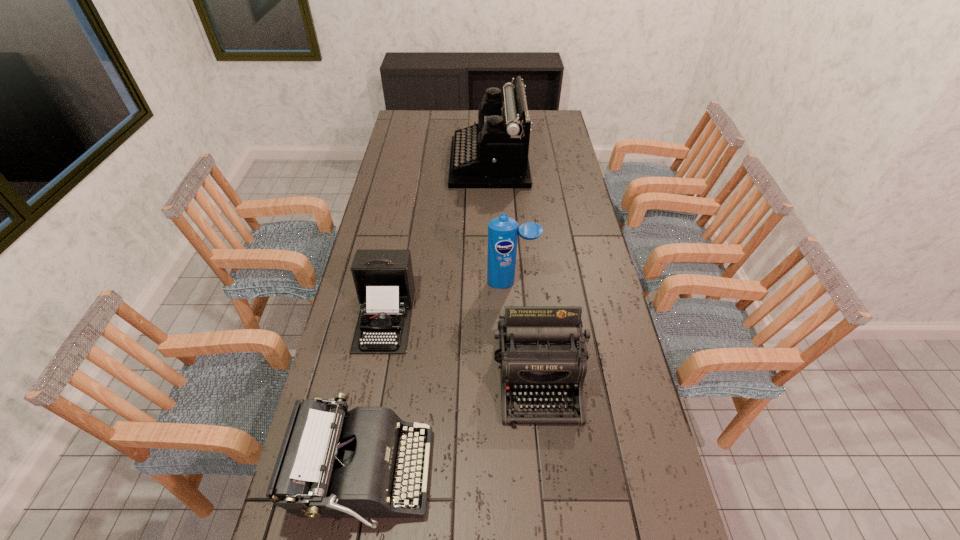
The height and width of the screenshot is (540, 960). In the image, there is a desktop. In order to click on vacant space at the left edge in this screenshot , I will do `click(420, 165)`.

At what (x,y) coordinates should I click in order to perform the action: click on vacant space at the right edge of the desktop. Please return your answer as a coordinate pair (x, y). The width and height of the screenshot is (960, 540). Looking at the image, I should click on (556, 183).

Find the location of `the third closest object to the farthest object`. the third closest object to the farthest object is located at coordinates (538, 351).

Choose which object is the nearest neighbor to the farthest object. Please provide its 2D coordinates. Your answer should be formatted as a tuple, i.e. [(x, y)], where the tuple contains the x and y coordinates of a point satisfying the conditions above.

[(503, 231)]

You are a GUI agent. You are given a task and a screenshot of the screen. Output one action in this format:
    pyautogui.click(x=<x>, y=<y>)
    Task: Click on the typewriter that is the second closest to the tallest typewriter
    The image size is (960, 540).
    Given the screenshot: What is the action you would take?
    pyautogui.click(x=538, y=351)

Identify which typewriter is the third closest to the farthest typewriter. Please provide its 2D coordinates. Your answer should be formatted as a tuple, i.e. [(x, y)], where the tuple contains the x and y coordinates of a point satisfying the conditions above.

[(333, 463)]

Where is `free point that satisfies the following two spatial constraints: 1. on the typing side of the farthest object; 2. on the left side of the shampoo`? free point that satisfies the following two spatial constraints: 1. on the typing side of the farthest object; 2. on the left side of the shampoo is located at coordinates (492, 282).

The image size is (960, 540). I want to click on vacant space that satisfies the following two spatial constraints: 1. on the typing side of the farthest typewriter; 2. on the back side of the shampoo, so (x=492, y=282).

This screenshot has height=540, width=960. Find the location of `vacant space that satisfies the following two spatial constraints: 1. on the typing side of the farthest typewriter; 2. on the left side of the shampoo`. vacant space that satisfies the following two spatial constraints: 1. on the typing side of the farthest typewriter; 2. on the left side of the shampoo is located at coordinates (492, 282).

Where is `vacant space that satisfies the following two spatial constraints: 1. on the typing side of the farthest object; 2. on the back side of the shampoo`? vacant space that satisfies the following two spatial constraints: 1. on the typing side of the farthest object; 2. on the back side of the shampoo is located at coordinates coord(492,282).